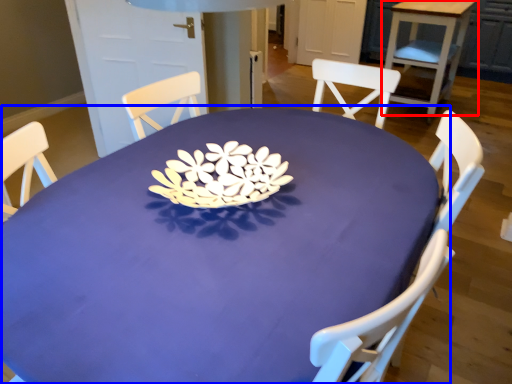
Question: Which of the following is the closest to the observer, table (highlighted by a red box) or table (highlighted by a blue box)?

Choices:
 (A) table
 (B) table

Answer: (B)